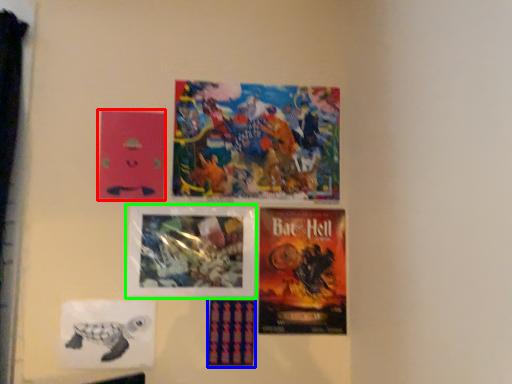
Question: Which is farther away from poster (highlighted by a red box)? poster (highlighted by a blue box) or poster (highlighted by a green box)?

Choices:
 (A) poster
 (B) poster

Answer: (A)